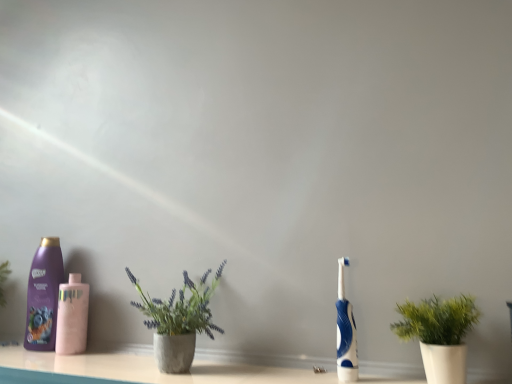
Question: Does purple glossy shampoo at left, the first bottle positioned from the left, contain concrete textured pot at center, which ranks as the second houseplant in right-to-left order?

Choices:
 (A) no
 (B) yes

Answer: (A)

Question: Is purple glossy shampoo at left, which appears as the second bottle when viewed from the right, positioned far away from concrete textured pot at center, the first houseplant when ordered from left to right?

Choices:
 (A) no
 (B) yes

Answer: (A)

Question: Is purple glossy shampoo at left, the first bottle positioned from the left, outside concrete textured pot at center, which ranks as the second houseplant in right-to-left order?

Choices:
 (A) yes
 (B) no

Answer: (A)

Question: Can you confirm if purple glossy shampoo at left, which appears as the second bottle when viewed from the right, is wider than concrete textured pot at center, which ranks as the second houseplant in right-to-left order?

Choices:
 (A) yes
 (B) no

Answer: (B)

Question: Is purple glossy shampoo at left, which appears as the second bottle when viewed from the right, oriented towards concrete textured pot at center, which ranks as the second houseplant in right-to-left order?

Choices:
 (A) no
 (B) yes

Answer: (A)

Question: Is the position of purple glossy shampoo at left, the first bottle positioned from the left, more distant than that of concrete textured pot at center, which ranks as the second houseplant in right-to-left order?

Choices:
 (A) yes
 (B) no

Answer: (A)

Question: Can you confirm if blue rubber toothbrush at right is wider than concrete textured pot at center, which ranks as the second houseplant in right-to-left order?

Choices:
 (A) yes
 (B) no

Answer: (B)

Question: Is concrete textured pot at center, the first houseplant when ordered from left to right, located within blue rubber toothbrush at right?

Choices:
 (A) yes
 (B) no

Answer: (B)

Question: From a real-world perspective, is blue rubber toothbrush at right over concrete textured pot at center, the first houseplant when ordered from left to right?

Choices:
 (A) yes
 (B) no

Answer: (B)

Question: Is blue rubber toothbrush at right to the right of concrete textured pot at center, which ranks as the second houseplant in right-to-left order, from the viewer's perspective?

Choices:
 (A) no
 (B) yes

Answer: (B)

Question: Are blue rubber toothbrush at right and concrete textured pot at center, the first houseplant when ordered from left to right, located far from each other?

Choices:
 (A) no
 (B) yes

Answer: (A)

Question: Is blue rubber toothbrush at right positioned in front of concrete textured pot at center, which ranks as the second houseplant in right-to-left order?

Choices:
 (A) no
 (B) yes

Answer: (A)

Question: From a real-world perspective, is concrete textured pot at center, the first houseplant when ordered from left to right, on top of blue rubber toothbrush at right?

Choices:
 (A) no
 (B) yes

Answer: (B)